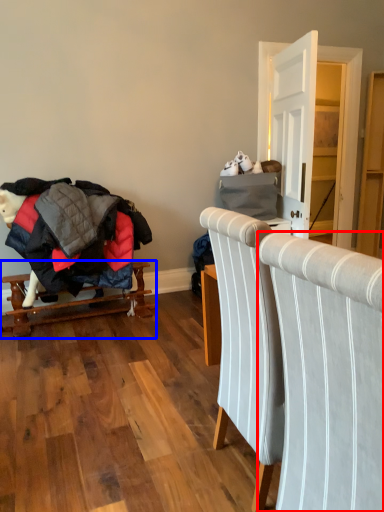
Question: Which of the following is the closest to the observer, chair (highlighted by a red box) or furniture (highlighted by a blue box)?

Choices:
 (A) chair
 (B) furniture

Answer: (A)